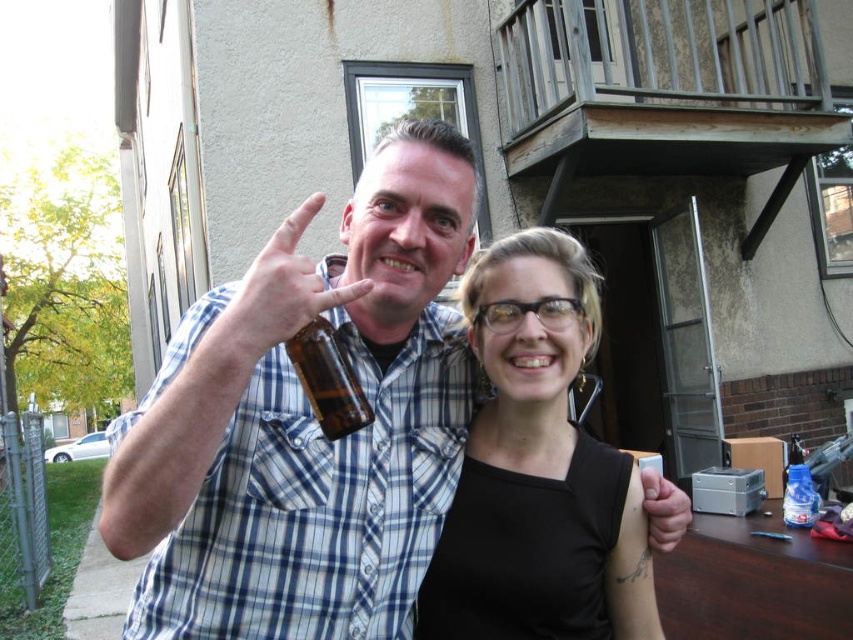
You are a photographer trying to capture the brown glass bottle at center in your shot. The camera is positioned at point A, and you need to adjust the focus to ensure the bottle is sharp. Given that the camera can only focus on objects within a 0.1 unit radius around point A, where should you place point A to ensure the bottle is in focus?

You should place point A at approximately the coordinates of the brown glass bottle at center, which is at point (328, 378), to ensure it falls within the focus range of the camera.

You are a photographer trying to capture a closeup shot of the brown glass beer bottle at center and the black matte tank top at center. If your camera can only focus on objects wider than 10 cm, which object will be in focus?

The brown glass beer bottle at center is wider than the black matte tank top at center. Since the beer bottle is wider than 10 cm, it will be in focus, but the tank top may not be if it is narrower than 10 cm. However, the description only states the beer bottle is wider than the tank top, not their exact widths. Without knowing the exact width of the tank top, we cannot confirm if it meets the 10 cm requirement.